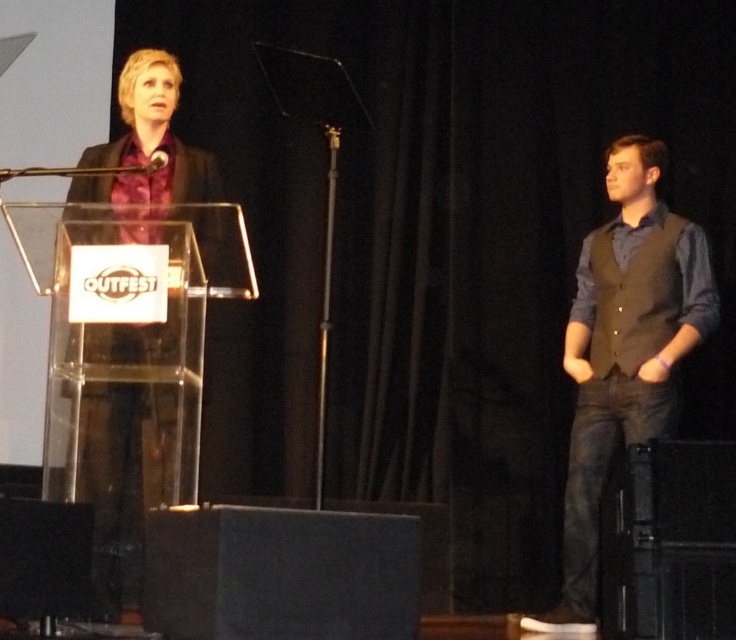
Question: Does dark gray vest at right appear on the right side of metallic silver microphone at upper center?

Choices:
 (A) no
 (B) yes

Answer: (B)

Question: Does dark gray vest at right come in front of metallic silver microphone at upper center?

Choices:
 (A) yes
 (B) no

Answer: (B)

Question: Does dark gray vest at right have a smaller size compared to metallic silver microphone at upper center?

Choices:
 (A) yes
 (B) no

Answer: (B)